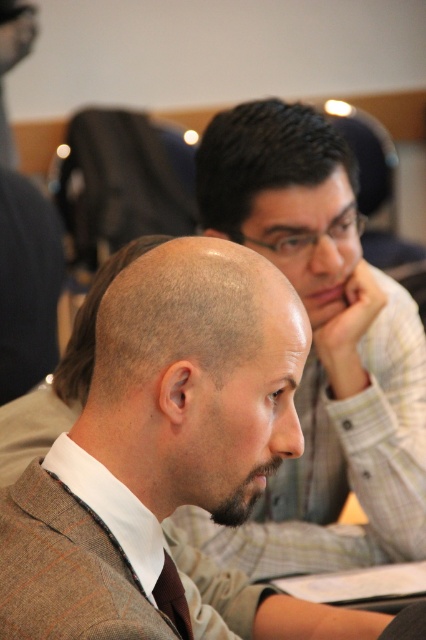
Question: Which point appears farthest from the camera in this image?

Choices:
 (A) (199, 209)
 (B) (210, 509)

Answer: (A)

Question: Can you confirm if brown hair at center is positioned above matte gray shirt at center?

Choices:
 (A) no
 (B) yes

Answer: (A)

Question: Estimate the real-world distances between objects in this image. Which object is farther from the brown hair at center?

Choices:
 (A) brown woven tie at center
 (B) matte gray shirt at center
 (C) dark brown beard at center

Answer: (B)

Question: Among these points, which one is farthest from the camera?

Choices:
 (A) (345, 268)
 (B) (226, 500)

Answer: (A)

Question: Is the position of matte gray shirt at center more distant than that of brown woven tie at center?

Choices:
 (A) no
 (B) yes

Answer: (B)

Question: Does matte gray shirt at center have a larger size compared to dark brown beard at center?

Choices:
 (A) yes
 (B) no

Answer: (A)